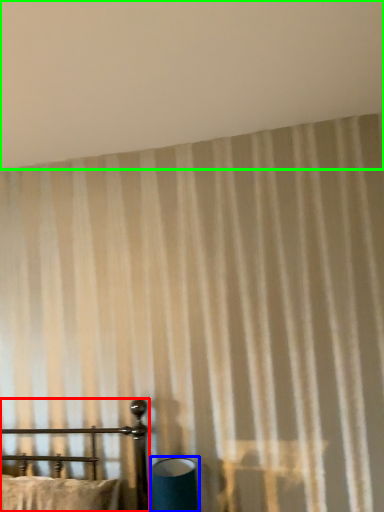
Question: Estimate the real-world distances between objects in this image. Which object is closer to furniture (highlighted by a red box), table lamp (highlighted by a blue box) or backdrop (highlighted by a green box)?

Choices:
 (A) table lamp
 (B) backdrop

Answer: (A)